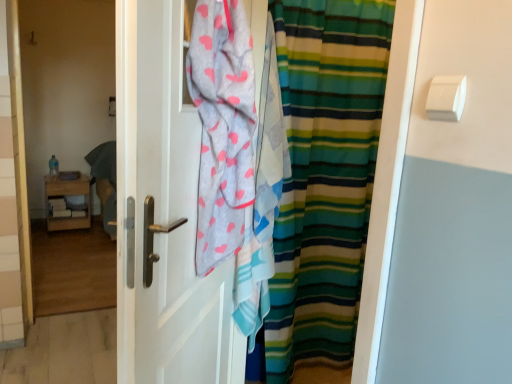
Question: Does teal fabric at left have a smaller size compared to light gray cotton towel at center?

Choices:
 (A) no
 (B) yes

Answer: (B)

Question: Considering the relative sizes of teal fabric at left and light gray cotton towel at center in the image provided, is teal fabric at left taller than light gray cotton towel at center?

Choices:
 (A) yes
 (B) no

Answer: (B)

Question: From a real-world perspective, is teal fabric at left physically above light gray cotton towel at center?

Choices:
 (A) no
 (B) yes

Answer: (A)

Question: Is light gray cotton towel at center at the back of teal fabric at left?

Choices:
 (A) no
 (B) yes

Answer: (A)

Question: Considering the relative sizes of teal fabric at left and light gray cotton towel at center in the image provided, is teal fabric at left thinner than light gray cotton towel at center?

Choices:
 (A) yes
 (B) no

Answer: (A)

Question: Based on their positions, is light gray cotton towel at center located to the left or right of striped fabric curtain at center?

Choices:
 (A) left
 (B) right

Answer: (A)

Question: Is light gray cotton towel at center spatially inside striped fabric curtain at center, or outside of it?

Choices:
 (A) outside
 (B) inside

Answer: (A)

Question: From a real-world perspective, is light gray cotton towel at center positioned above or below striped fabric curtain at center?

Choices:
 (A) below
 (B) above

Answer: (B)

Question: Looking at the image, does light gray cotton towel at center seem bigger or smaller compared to striped fabric curtain at center?

Choices:
 (A) big
 (B) small

Answer: (B)

Question: Considering the positions of white matte door at center and teal fabric at left in the image, is white matte door at center taller or shorter than teal fabric at left?

Choices:
 (A) short
 (B) tall

Answer: (B)

Question: Is point (167, 110) positioned closer to the camera than point (53, 165)?

Choices:
 (A) closer
 (B) farther

Answer: (A)

Question: Is white matte door at center inside the boundaries of teal fabric at left, or outside?

Choices:
 (A) inside
 (B) outside

Answer: (B)

Question: From a real-world perspective, relative to teal fabric at left, is white matte door at center vertically above or below?

Choices:
 (A) above
 (B) below

Answer: (A)

Question: From a real-world perspective, is teal fabric at left positioned above or below white plastic towel bar at upper right?

Choices:
 (A) below
 (B) above

Answer: (A)

Question: From their relative heights in the image, would you say teal fabric at left is taller or shorter than white plastic towel bar at upper right?

Choices:
 (A) tall
 (B) short

Answer: (A)